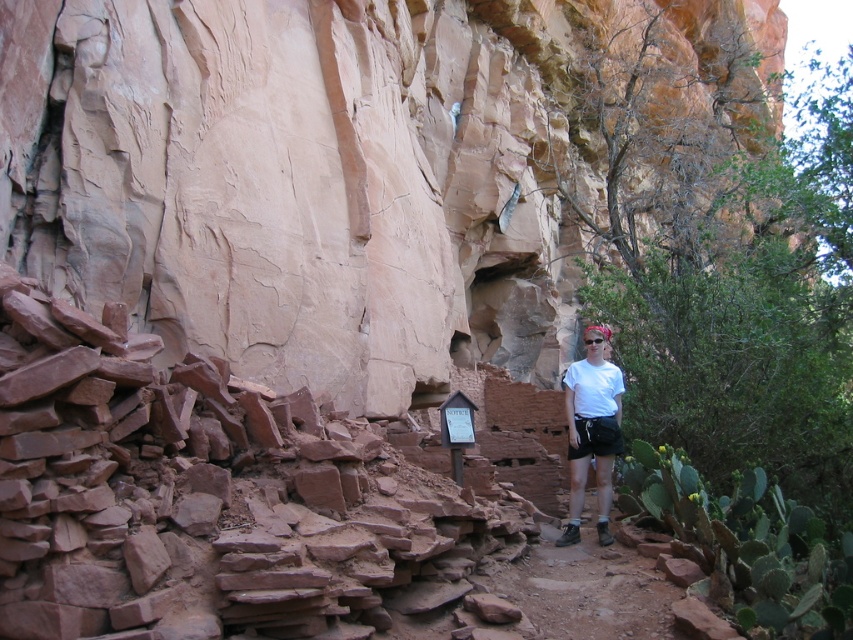
Question: Does rustic stone rubble at center-left appear on the left side of white cotton shirt at center?

Choices:
 (A) yes
 (B) no

Answer: (A)

Question: Among these points, which one is nearest to the camera?

Choices:
 (A) (126, 500)
 (B) (598, 512)

Answer: (A)

Question: Does rustic stone rubble at center-left appear under white cotton shirt at center?

Choices:
 (A) yes
 (B) no

Answer: (A)

Question: Does rustic stone rubble at center-left have a smaller size compared to white cotton shirt at center?

Choices:
 (A) no
 (B) yes

Answer: (A)